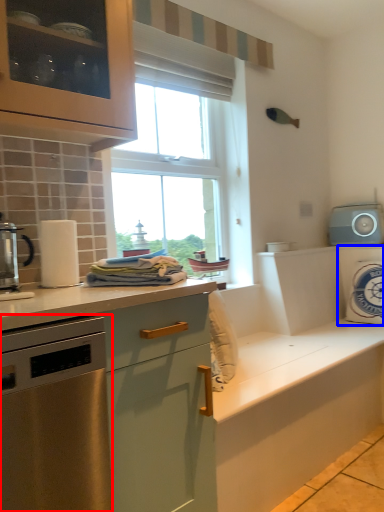
Question: Which object appears closest to the camera in this image, home appliance (highlighted by a red box) or appliance (highlighted by a blue box)?

Choices:
 (A) home appliance
 (B) appliance

Answer: (A)